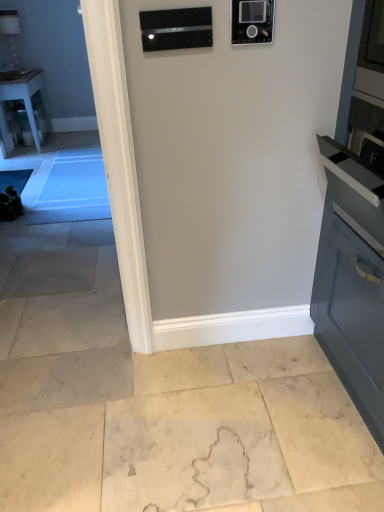
What do you see at coordinates (201, 438) in the screenshot?
I see `beige marble floor at lower center` at bounding box center [201, 438].

I want to click on black glass microwave at upper center, placed as the 2th appliance when sorted from right to left, so click(x=176, y=29).

Who is smaller, black glass microwave at upper center, which is counted as the first appliance, starting from the left, or clear glass table at left?

black glass microwave at upper center, which is counted as the first appliance, starting from the left, is smaller.

Can you tell me how much black glass microwave at upper center, placed as the 2th appliance when sorted from right to left, and clear glass table at left differ in facing direction?

black glass microwave at upper center, placed as the 2th appliance when sorted from right to left, and clear glass table at left are facing 89.4 degrees away from each other.

Would you say black glass microwave at upper center, which is counted as the first appliance, starting from the left, is outside clear glass table at left?

Yes, black glass microwave at upper center, which is counted as the first appliance, starting from the left, is located beyond the bounds of clear glass table at left.

Which is behind, point (198, 14) or point (43, 85)?

Positioned behind is point (43, 85).

Identify the location of concrete located underneath the clear glass table at left (from a real-world perspective). This screenshot has width=384, height=512. click(201, 438).

Considering the relative sizes of clear glass table at left and beige marble floor at lower center in the image provided, is clear glass table at left smaller than beige marble floor at lower center?

Actually, clear glass table at left might be larger than beige marble floor at lower center.

Between point (27, 101) and point (83, 451), which one is positioned behind?

The point (27, 101) is farther from the camera.

Considering the positions of objects clear glass table at left and beige marble floor at lower center in the image provided, who is in front, clear glass table at left or beige marble floor at lower center?

beige marble floor at lower center is in front.

Is beige marble floor at lower center not close to black glossy microwave at upper center, which ranks as the 1th appliance in right-to-left order?

beige marble floor at lower center is positioned a significant distance from black glossy microwave at upper center, which ranks as the 1th appliance in right-to-left order.

From the image's perspective, between beige marble floor at lower center and black glossy microwave at upper center, which ranks as the 1th appliance in right-to-left order, who is located below?

beige marble floor at lower center is shown below in the image.

From the picture: Considering the relative sizes of beige marble floor at lower center and black glossy microwave at upper center, which is counted as the 2th appliance, starting from the left, in the image provided, is beige marble floor at lower center thinner than black glossy microwave at upper center, which is counted as the 2th appliance, starting from the left,?

Incorrect, the width of beige marble floor at lower center is not less than that of black glossy microwave at upper center, which is counted as the 2th appliance, starting from the left.

Is black glass microwave at upper center, which is counted as the first appliance, starting from the left, completely or partially inside clear glass table at left?

No, clear glass table at left does not contain black glass microwave at upper center, which is counted as the first appliance, starting from the left.

From the image's perspective, does clear glass table at left appear higher than black glass microwave at upper center, which is counted as the first appliance, starting from the left?

Correct, clear glass table at left appears higher than black glass microwave at upper center, which is counted as the first appliance, starting from the left, in the image.

Can you tell me how much clear glass table at left and black glass microwave at upper center, which is counted as the first appliance, starting from the left, differ in facing direction?

There is a 89.4-degree angle between the facing directions of clear glass table at left and black glass microwave at upper center, which is counted as the first appliance, starting from the left.

Is point (48, 131) less distant than point (209, 22)?

No, it is behind (209, 22).

Is point (259, 22) farther from viewer compared to point (68, 477)?

No, (259, 22) is closer to viewer.

From a real-world perspective, is black glossy microwave at upper center, which is counted as the 2th appliance, starting from the left, beneath beige marble floor at lower center?

No, from a real-world perspective, black glossy microwave at upper center, which is counted as the 2th appliance, starting from the left, is not under beige marble floor at lower center.

Can we say black glossy microwave at upper center, which ranks as the 1th appliance in right-to-left order, lies outside beige marble floor at lower center?

Indeed, black glossy microwave at upper center, which ranks as the 1th appliance in right-to-left order, is completely outside beige marble floor at lower center.

Which is farther, (206, 378) or (149, 24)?

The point (206, 378) is farther.

Is beige marble floor at lower center beside black glass microwave at upper center, placed as the 2th appliance when sorted from right to left?

They are not placed beside each other.

From the image's perspective, between beige marble floor at lower center and black glass microwave at upper center, placed as the 2th appliance when sorted from right to left, who is located below?

beige marble floor at lower center, from the image's perspective.

Does beige marble floor at lower center have a smaller size compared to clear glass table at left?

Yes.

Which object is positioned more to the right, beige marble floor at lower center or clear glass table at left?

beige marble floor at lower center is more to the right.

The image size is (384, 512). Identify the location of concrete in front of the clear glass table at left. [x=201, y=438].

What are the coordinates of `table above the black glass microwave at upper center, placed as the 2th appliance when sorted from right to left (from the image's perspective)` in the screenshot? It's located at (24, 102).

Find the location of `concrete below the clear glass table at left (from the image's perspective)`. concrete below the clear glass table at left (from the image's perspective) is located at coordinates (201, 438).

Looking at the image, which one is located further to beige marble floor at lower center, clear glass table at left or black glossy microwave at upper center, which ranks as the 1th appliance in right-to-left order?

clear glass table at left is further to beige marble floor at lower center.

Based on their spatial positions, is beige marble floor at lower center or clear glass table at left closer to black glossy microwave at upper center, which is counted as the 2th appliance, starting from the left?

beige marble floor at lower center.

From the image, which object appears to be farther from black glass microwave at upper center, placed as the 2th appliance when sorted from right to left, beige marble floor at lower center or black glossy microwave at upper center, which is counted as the 2th appliance, starting from the left?

beige marble floor at lower center.

Consider the image. Which object lies nearer to the anchor point clear glass table at left, black glossy microwave at upper center, which ranks as the 1th appliance in right-to-left order, or beige marble floor at lower center?

beige marble floor at lower center is positioned closer to the anchor clear glass table at left.

Considering their positions, is clear glass table at left positioned closer to beige marble floor at lower center than black glass microwave at upper center, placed as the 2th appliance when sorted from right to left?

Among the two, black glass microwave at upper center, placed as the 2th appliance when sorted from right to left, is located nearer to beige marble floor at lower center.

From the image, which object appears to be farther from black glossy microwave at upper center, which is counted as the 2th appliance, starting from the left, clear glass table at left or beige marble floor at lower center?

Based on the image, clear glass table at left appears to be further to black glossy microwave at upper center, which is counted as the 2th appliance, starting from the left.

When comparing their distances from clear glass table at left, does black glossy microwave at upper center, which ranks as the 1th appliance in right-to-left order, or black glass microwave at upper center, which is counted as the first appliance, starting from the left, seem further?

Among the two, black glossy microwave at upper center, which ranks as the 1th appliance in right-to-left order, is located further to clear glass table at left.

Looking at the image, which one is located closer to clear glass table at left, black glass microwave at upper center, placed as the 2th appliance when sorted from right to left, or beige marble floor at lower center?

black glass microwave at upper center, placed as the 2th appliance when sorted from right to left, lies closer to clear glass table at left than the other object.

Identify the location of appliance between black glossy microwave at upper center, which is counted as the 2th appliance, starting from the left, and beige marble floor at lower center, in the vertical direction. This screenshot has height=512, width=384. (176, 29).

This screenshot has height=512, width=384. I want to click on appliance positioned between black glass microwave at upper center, placed as the 2th appliance when sorted from right to left, and clear glass table at left from near to far, so (x=252, y=21).